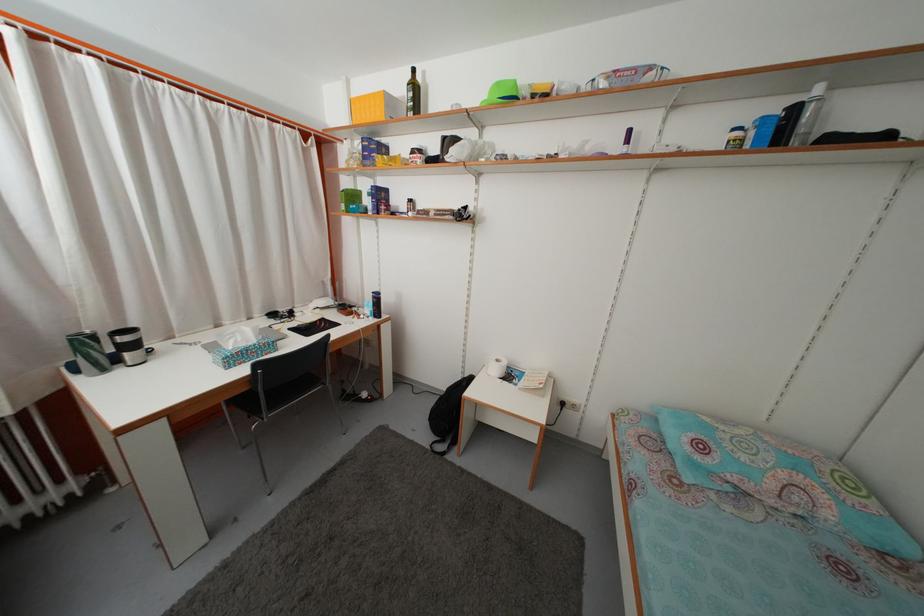
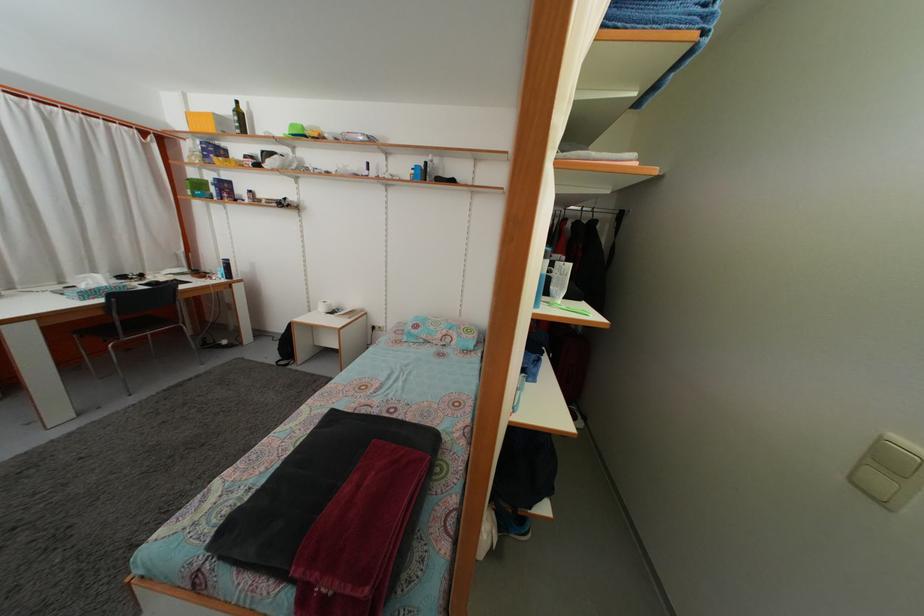
The point at (420,95) is marked in the first image. Where is the corresponding point in the second image?

(246, 122)